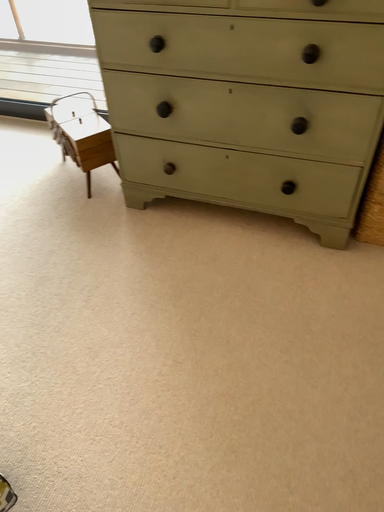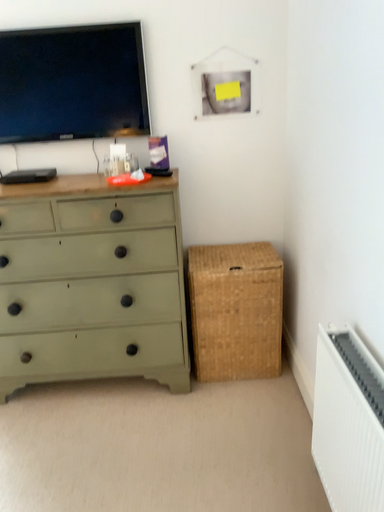
Question: Which way did the camera rotate in the video?

Choices:
 (A) rotated upward
 (B) rotated downward

Answer: (A)